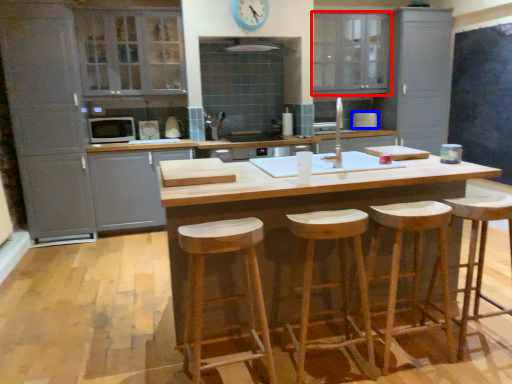
Question: Which point is further to the camera, cabinetry (highlighted by a red box) or appliance (highlighted by a blue box)?

Choices:
 (A) cabinetry
 (B) appliance

Answer: (B)